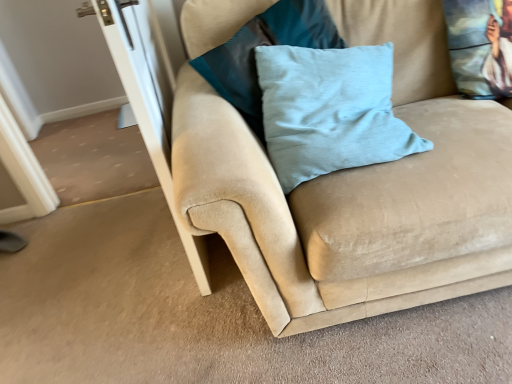
Question: Based on their positions, is light blue velvet pillow at center, the second pillow when ordered from right to left, located to the left or right of transparent glass screen door at left?

Choices:
 (A) left
 (B) right

Answer: (B)

Question: Is light blue velvet pillow at center, which is the 2th pillow in left-to-right order, in front of or behind transparent glass screen door at left in the image?

Choices:
 (A) behind
 (B) front

Answer: (A)

Question: Which is farther from the light blue velvet pillow at center, the second pillow when ordered from right to left?

Choices:
 (A) light blue fabric pillow at center, the first pillow positioned from the left
 (B) transparent glass screen door at left
 (C) suede couch at center
 (D) printed fabric cushion at upper right, which is the third pillow in left-to-right order

Answer: (D)

Question: Estimate the real-world distances between objects in this image. Which object is closer to the printed fabric cushion at upper right, which is the third pillow in left-to-right order?

Choices:
 (A) light blue fabric pillow at center, which ranks as the 3th pillow in right-to-left order
 (B) suede couch at center
 (C) transparent glass screen door at left
 (D) light blue velvet pillow at center, which is the 2th pillow in left-to-right order

Answer: (B)